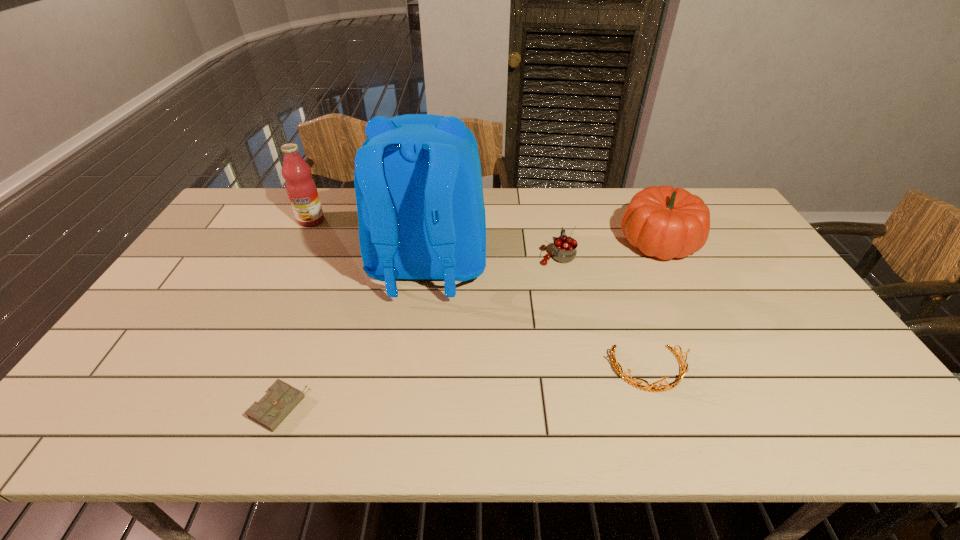
Locate an element on the screen. free region located on the back of the tallest object is located at coordinates pyautogui.click(x=405, y=438).

Find the location of a particular element. The height and width of the screenshot is (540, 960). blank area located on the label of the fruit juice is located at coordinates (289, 264).

Find the location of a particular element. vacant point located 0.090m on the front of the fourth shortest object is located at coordinates (682, 288).

The image size is (960, 540). Find the location of `free space located 0.300m on the handle side of the fourth object from left to right`. free space located 0.300m on the handle side of the fourth object from left to right is located at coordinates (544, 195).

At what (x,y) coordinates should I click in order to perform the action: click on free spot located on the handle side of the fourth object from left to right. Please return your answer as a coordinate pair (x, y). The width and height of the screenshot is (960, 540). Looking at the image, I should click on (551, 228).

You are a GUI agent. You are given a task and a screenshot of the screen. Output one action in this format:
    pyautogui.click(x=<x>, y=<y>)
    Task: Click on the vacant space located 0.260m on the handle side of the fourth object from left to right
    
    Given the screenshot: What is the action you would take?
    pyautogui.click(x=546, y=201)

In order to click on free space located on the front-facing side of the fifth tallest object in this screenshot , I will do `click(669, 428)`.

Locate an element on the screen. This screenshot has height=540, width=960. free space located 0.190m on the left of the diary is located at coordinates [x=169, y=409].

I want to click on fruit juice positioned at the far edge, so click(x=301, y=188).

Where is `pumpkin at the far edge`? The width and height of the screenshot is (960, 540). pumpkin at the far edge is located at coordinates (664, 222).